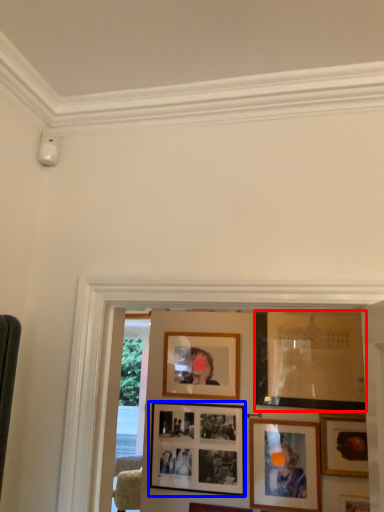
Question: Among these objects, which one is farthest to the camera, picture frame (highlighted by a red box) or picture frame (highlighted by a blue box)?

Choices:
 (A) picture frame
 (B) picture frame

Answer: (B)